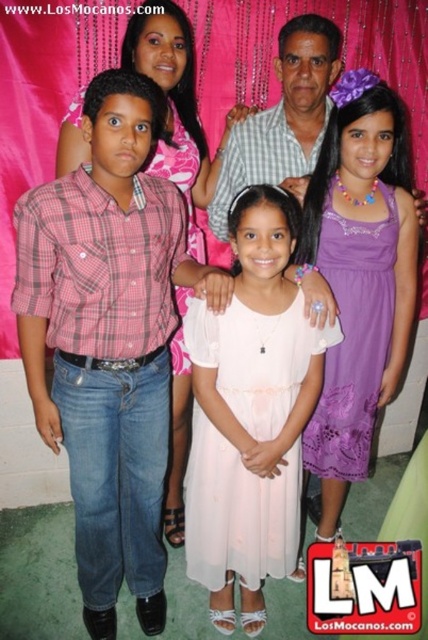
You are a photographer trying to adjust the spacing between the pink sheer dress at center and the checkered fabric shirt at center so that both fit comfortably within the frame. Based on their widths, which clothing item requires more space horizontally?

The pink sheer dress at center requires more horizontal space because its width surpasses that of the checkered fabric shirt at center.